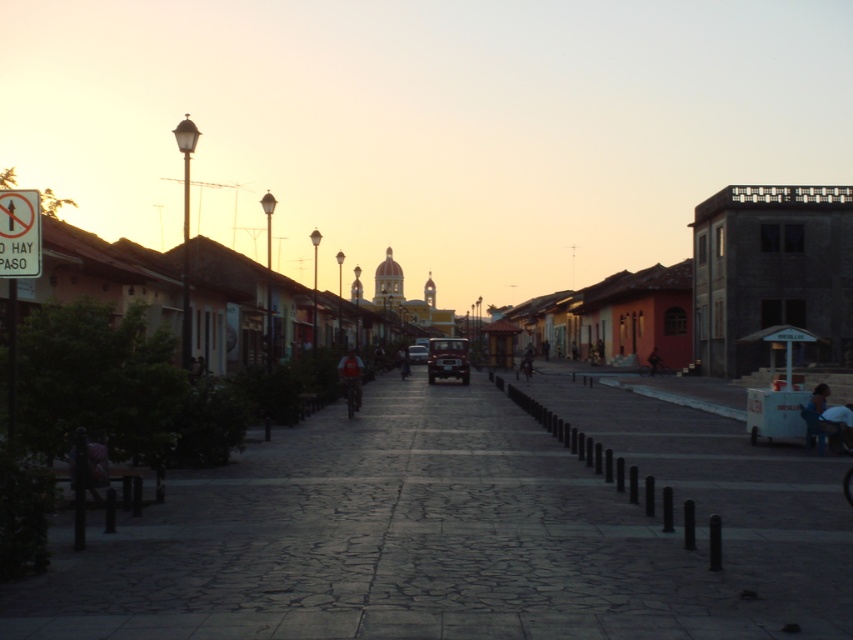
Question: Can you confirm if red fabric shirt at center is wider than dark blue jeans at center?

Choices:
 (A) yes
 (B) no

Answer: (A)

Question: Among these objects, which one is nearest to the camera?

Choices:
 (A) dark blue jeans at center
 (B) pink fabric person at lower left
 (C) dark blue jeans at lower right
 (D) red fabric shirt at center

Answer: (B)

Question: Can you confirm if gray stone pavement at center is wider than pink fabric person at lower left?

Choices:
 (A) yes
 (B) no

Answer: (A)

Question: Among these points, which one is farthest from the camera?

Choices:
 (A) (654, 355)
 (B) (447, 518)

Answer: (A)

Question: Which of the following is the closest to the observer?

Choices:
 (A) gray stone pavement at center
 (B) red fabric shirt at center
 (C) dark blue jeans at lower right

Answer: (A)

Question: Does red fabric shirt at center appear on the left side of dark blue jeans at center?

Choices:
 (A) yes
 (B) no

Answer: (A)